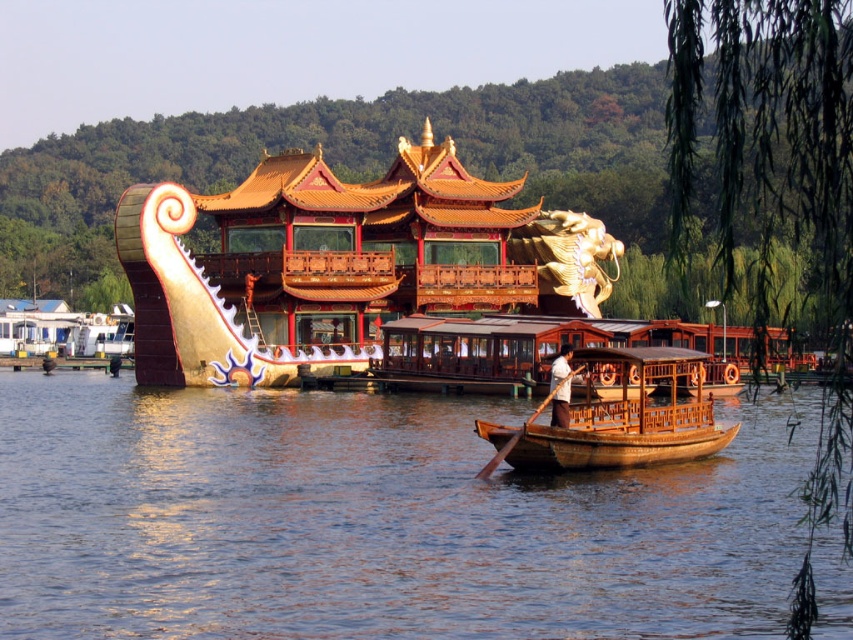
Question: Does brown wooden boat at center appear on the right side of wooden at center?

Choices:
 (A) yes
 (B) no

Answer: (B)

Question: Does wooden boat at center have a larger size compared to wooden at center?

Choices:
 (A) no
 (B) yes

Answer: (B)

Question: Which of these objects is positioned closest to the wooden boat at center?

Choices:
 (A) wooden at center
 (B) brown wooden boat at center

Answer: (A)

Question: Which of these objects is positioned closest to the brown wooden boat at center?

Choices:
 (A) wooden at center
 (B) wooden boat at center

Answer: (B)

Question: Does brown wooden boat at center appear over wooden boat at center?

Choices:
 (A) yes
 (B) no

Answer: (B)

Question: Which of the following is the closest to the observer?

Choices:
 (A) wooden at center
 (B) brown wooden boat at center
 (C) wooden boat at center

Answer: (B)